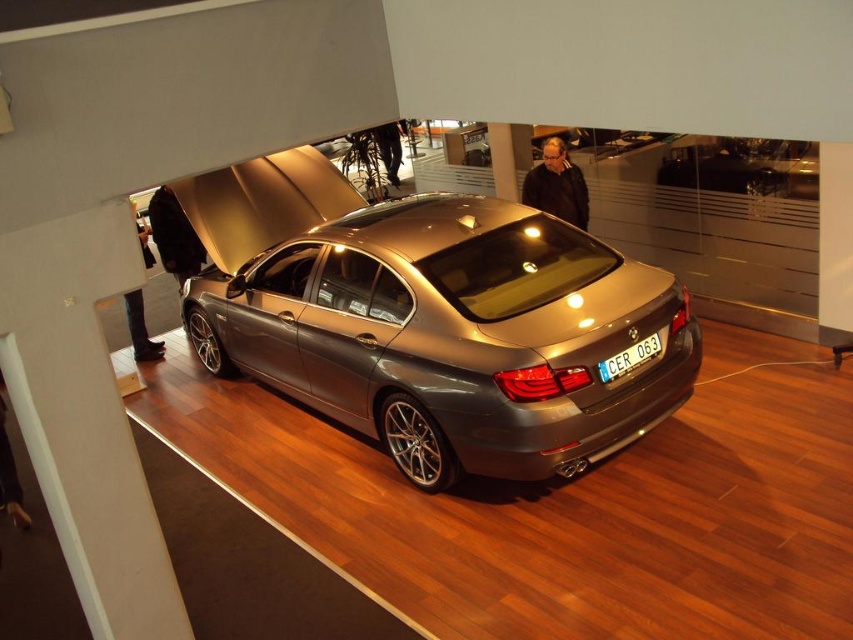
Question: From the image, what is the correct spatial relationship of black leather jacket at upper center in relation to white plastic license plate at rear?

Choices:
 (A) left
 (B) right

Answer: (A)

Question: Is satin metallic car at center further to the viewer compared to black leather jacket at upper center?

Choices:
 (A) yes
 (B) no

Answer: (B)

Question: Based on their relative distances, which object is nearer to the satin metallic car at center?

Choices:
 (A) black leather jacket at upper center
 (B) white plastic license plate at rear
 (C) dark gray suit at lower left

Answer: (B)

Question: Among these objects, which one is nearest to the camera?

Choices:
 (A) dark gray suit at lower left
 (B) black leather jacket at upper center

Answer: (B)

Question: Does dark gray suit at lower left have a lesser width compared to white plastic license plate at rear?

Choices:
 (A) no
 (B) yes

Answer: (B)

Question: Which point is farther to the camera?

Choices:
 (A) (540, 189)
 (B) (132, 353)

Answer: (B)